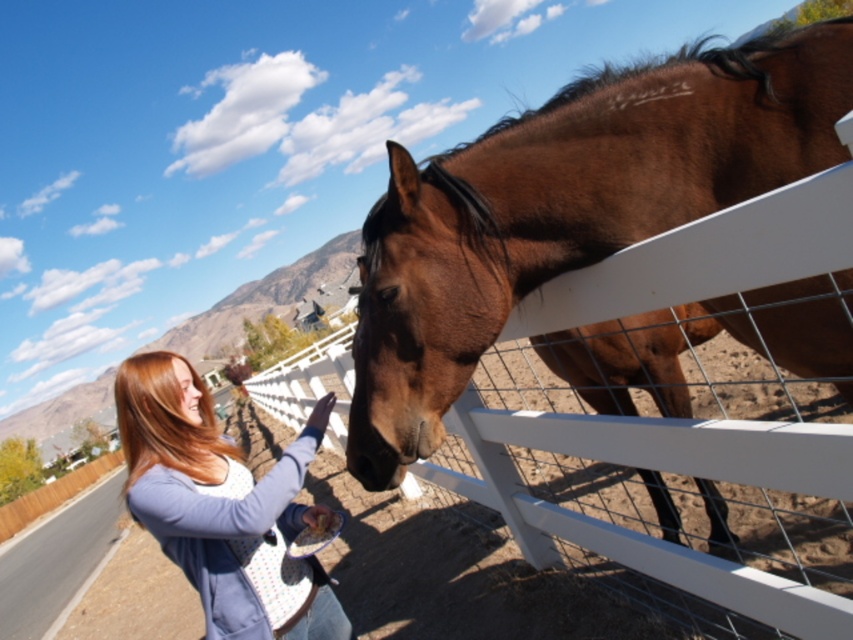
Is brown glossy horse at center in front of matte blue sweater at lower left?

Yes, brown glossy horse at center is in front of matte blue sweater at lower left.

Which of these two, brown glossy horse at center or matte blue sweater at lower left, stands shorter?

brown glossy horse at center is shorter.

At what (x,y) coordinates should I click in order to perform the action: click on brown glossy horse at center. Please return your answer as a coordinate pair (x, y). Looking at the image, I should click on (567, 209).